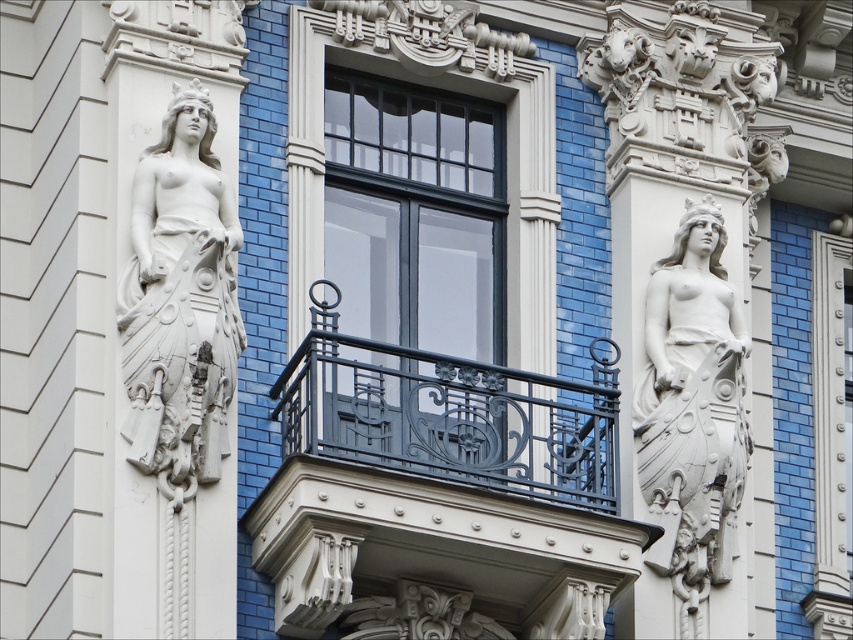
Question: Is dark gray wrought iron balcony at center behind matte black window at center?

Choices:
 (A) yes
 (B) no

Answer: (B)

Question: Is matte black window at center below white stone statue at right?

Choices:
 (A) no
 (B) yes

Answer: (A)

Question: Estimate the real-world distances between objects in this image. Which object is closer to the dark gray wrought iron balcony at center?

Choices:
 (A) white stone statue at right
 (B) matte black window at center
 (C) white stone statue at left
 (D) white stone statue at center

Answer: (A)

Question: Considering the real-world distances, which object is closest to the matte black window at center?

Choices:
 (A) white stone statue at center
 (B) white stone statue at left
 (C) white stone statue at right

Answer: (A)

Question: Which object is farther from the camera taking this photo?

Choices:
 (A) matte black window at center
 (B) white stone statue at right
 (C) white stone statue at left

Answer: (A)

Question: In this image, where is dark gray wrought iron balcony at center located relative to matte black window at center?

Choices:
 (A) below
 (B) above

Answer: (A)